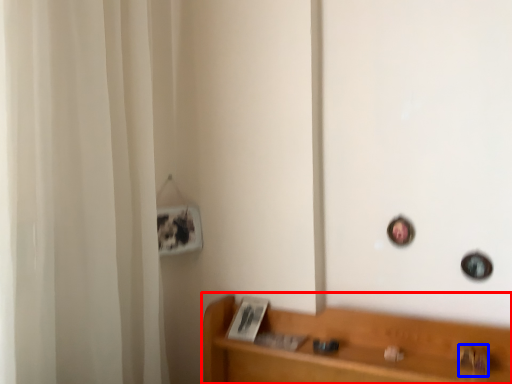
Question: Which object appears farthest to the camera in this image, furniture (highlighted by a red box) or door handle (highlighted by a blue box)?

Choices:
 (A) furniture
 (B) door handle

Answer: (B)